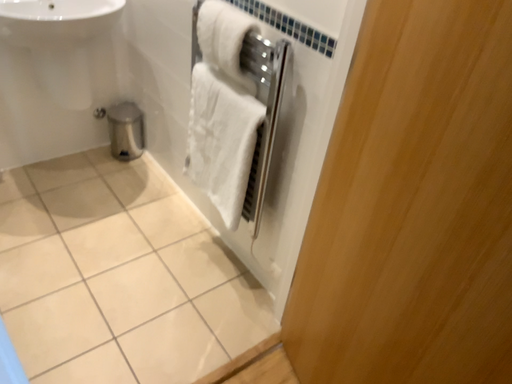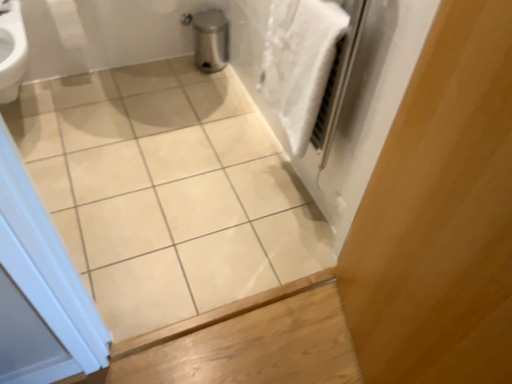
Question: How did the camera likely rotate when shooting the video?

Choices:
 (A) rotated left
 (B) rotated right

Answer: (A)